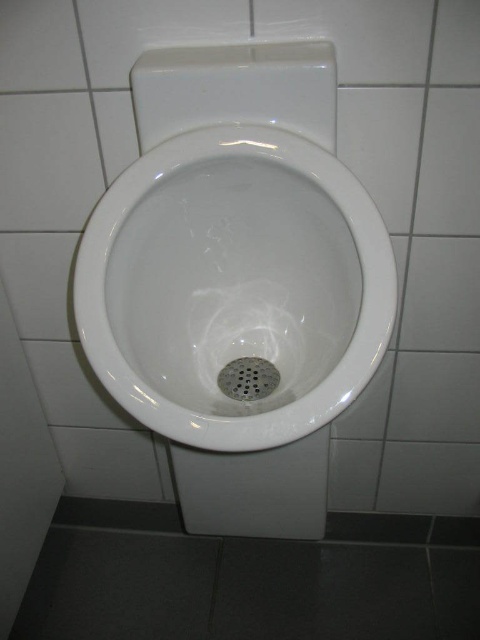
You are an interior designer assessing the uniformity of tiles in a bathroom. You notice two white tiles near the urinal. The first is the white glossy tile at upper left and the second is the white tile at upper right. Which of these two tiles has a greater width?

The white glossy tile at upper left has a greater width than the white tile at upper right.